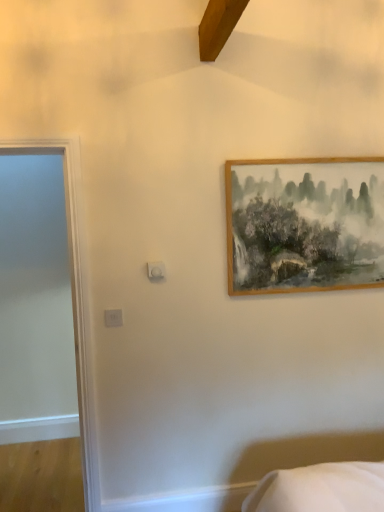
Question: Is white glossy door at left taller than wooden frame at upper right?

Choices:
 (A) no
 (B) yes

Answer: (B)

Question: Is white glossy door at left smaller than wooden frame at upper right?

Choices:
 (A) yes
 (B) no

Answer: (B)

Question: Is white glossy door at left looking in the opposite direction of wooden frame at upper right?

Choices:
 (A) no
 (B) yes

Answer: (A)

Question: Can you confirm if white glossy door at left is thinner than wooden frame at upper right?

Choices:
 (A) no
 (B) yes

Answer: (A)

Question: Can you confirm if white glossy door at left is wider than wooden frame at upper right?

Choices:
 (A) yes
 (B) no

Answer: (A)

Question: Is white glossy door at left next to wooden frame at upper right and touching it?

Choices:
 (A) yes
 (B) no

Answer: (B)

Question: Is wooden frame at upper right with white glossy door at left?

Choices:
 (A) no
 (B) yes

Answer: (A)

Question: From the image's perspective, is wooden frame at upper right over white glossy door at left?

Choices:
 (A) yes
 (B) no

Answer: (A)

Question: Does wooden frame at upper right have a greater height compared to white glossy door at left?

Choices:
 (A) yes
 (B) no

Answer: (B)

Question: Are wooden frame at upper right and white glossy door at left located far from each other?

Choices:
 (A) no
 (B) yes

Answer: (B)

Question: From the image's perspective, is wooden frame at upper right beneath white glossy door at left?

Choices:
 (A) no
 (B) yes

Answer: (A)

Question: Is the depth of wooden frame at upper right greater than that of white glossy door at left?

Choices:
 (A) no
 (B) yes

Answer: (B)

Question: From a real-world perspective, is wooden frame at upper right physically located above or below white glossy door at left?

Choices:
 (A) above
 (B) below

Answer: (A)